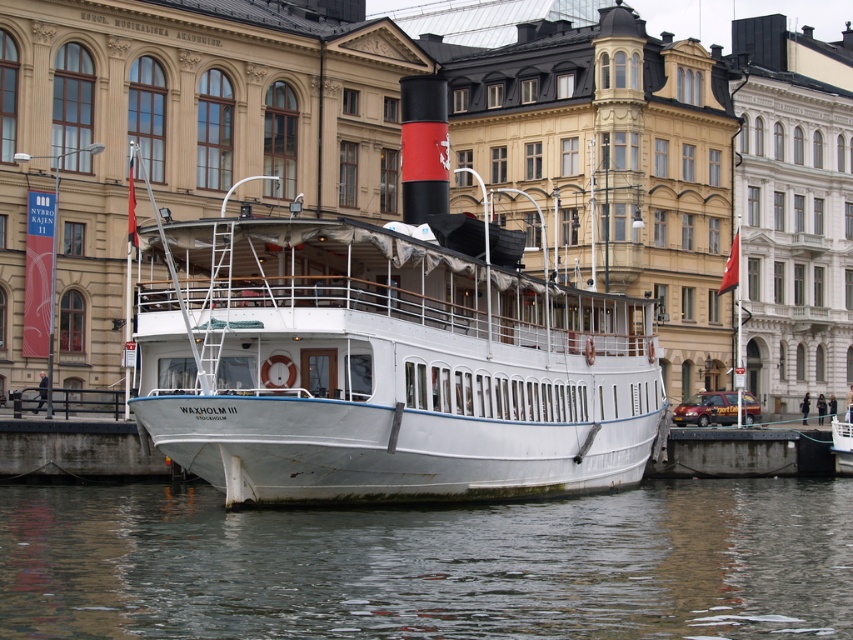
Question: Can you confirm if smooth gray water at lower center is wider than concrete at lower center?

Choices:
 (A) yes
 (B) no

Answer: (A)

Question: Can you confirm if smooth gray water at lower center is smaller than concrete at lower center?

Choices:
 (A) yes
 (B) no

Answer: (B)

Question: Which of the following is the farthest from the observer?

Choices:
 (A) concrete at lower center
 (B) white matte boat at center

Answer: (A)

Question: Among these points, which one is farthest from the camera?

Choices:
 (A) (827, 456)
 (B) (202, 540)
 (C) (631, 346)

Answer: (A)

Question: Which point is farther to the camera?

Choices:
 (A) (288, 589)
 (B) (440, 451)

Answer: (B)

Question: Is smooth gray water at lower center positioned before concrete at lower center?

Choices:
 (A) yes
 (B) no

Answer: (A)